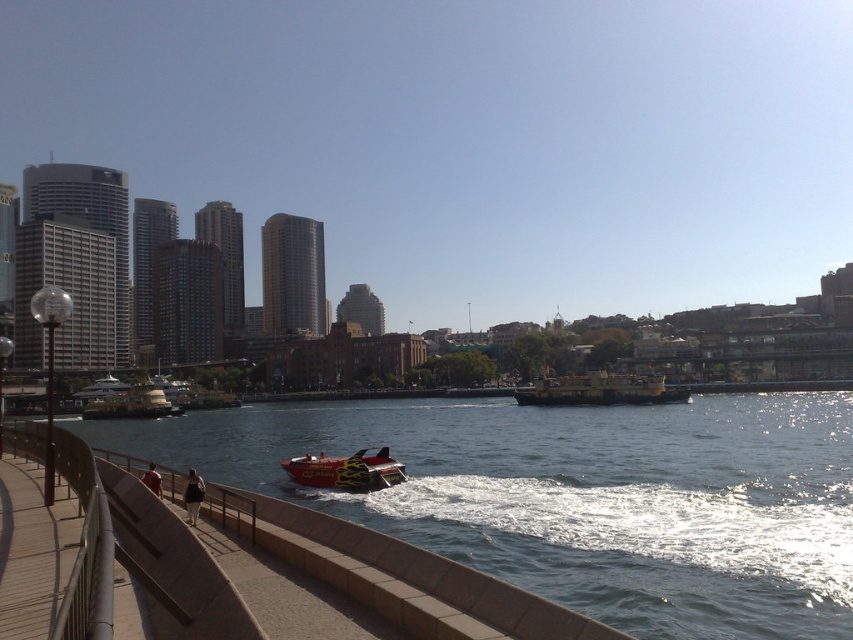
You are standing on the walkway and want to look at two points in the scene. The first point is at coordinates point (524, 403) and the second is at point (364, 486). Which point is closer to you?

Point (524, 403) is further to the viewer than point (364, 486), so the second point is closer to you.